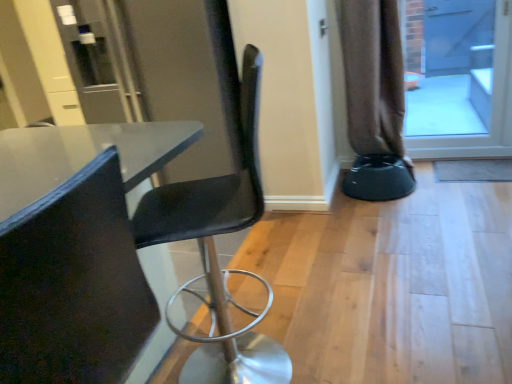
Where is `free space in front of black plastic bar stool at lower right`? free space in front of black plastic bar stool at lower right is located at coordinates (386, 221).